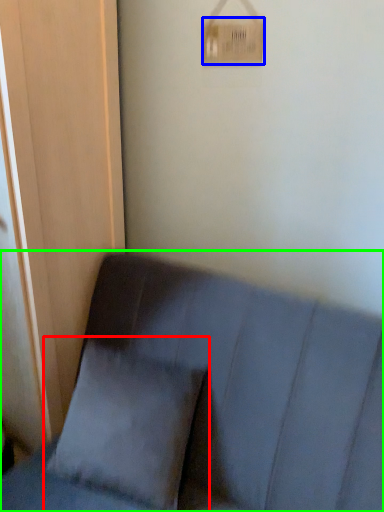
Question: Estimate the real-world distances between objects in this image. Which object is farther from pillow (highlighted by a red box), light switch (highlighted by a blue box) or furniture (highlighted by a green box)?

Choices:
 (A) light switch
 (B) furniture

Answer: (A)